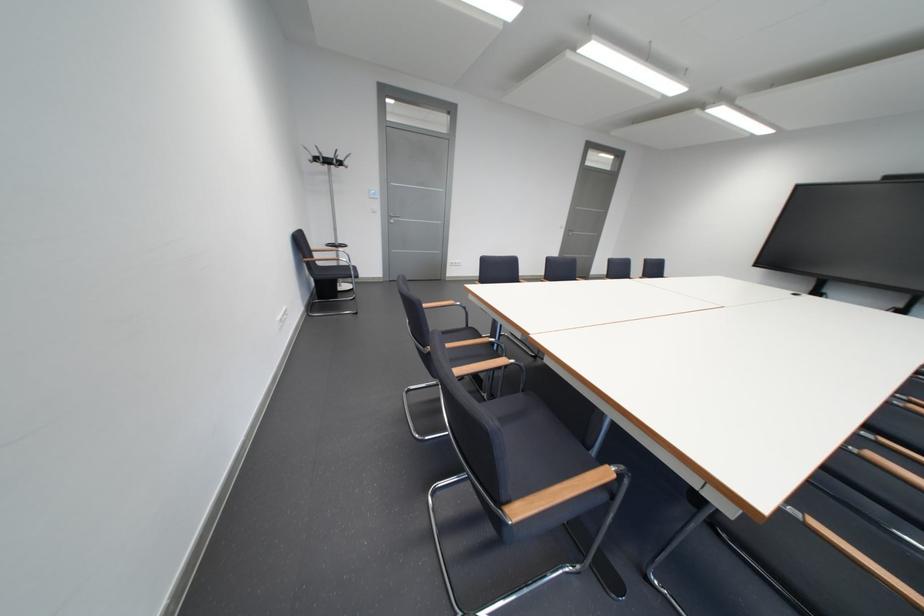
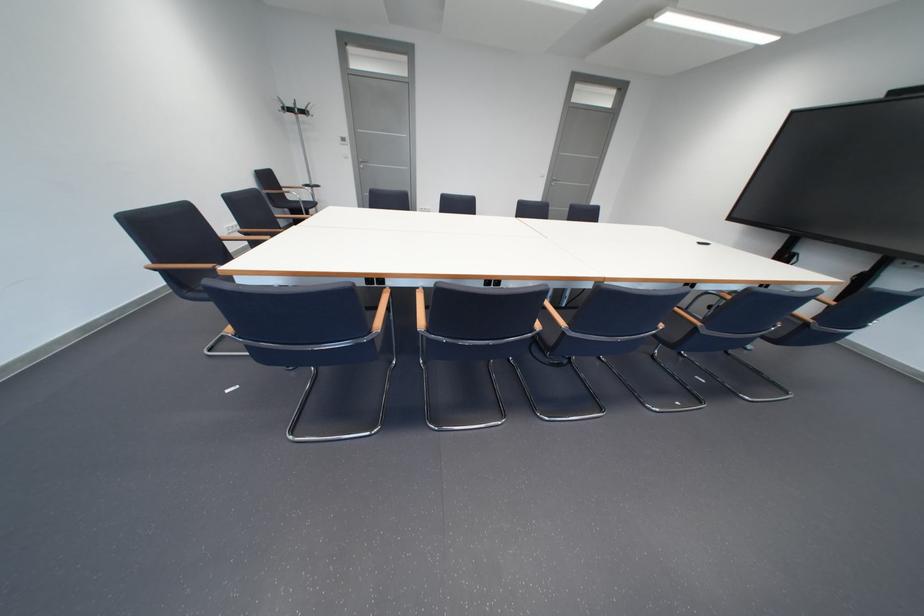
Locate, in the second image, the point that corresponds to the point at 341,163 in the first image.

(304, 111)